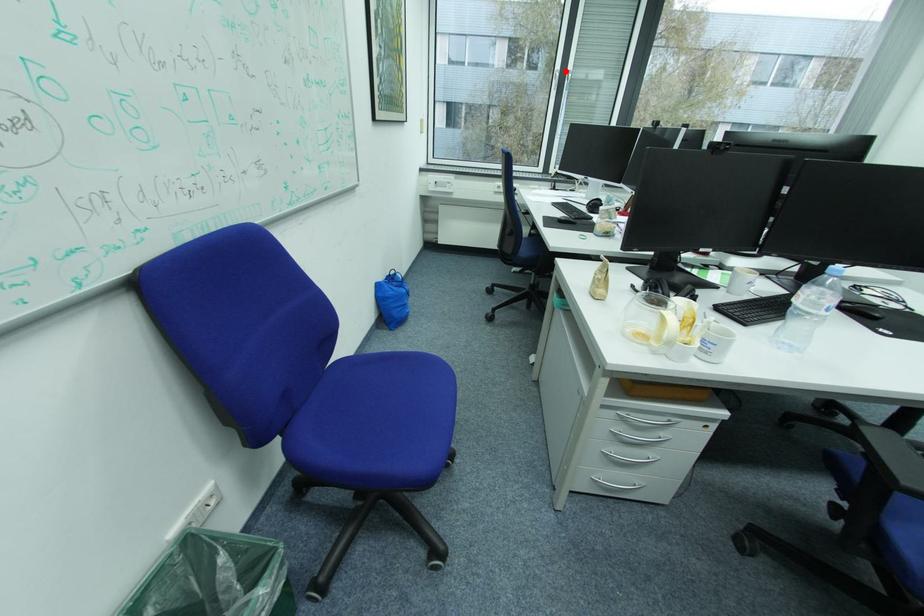
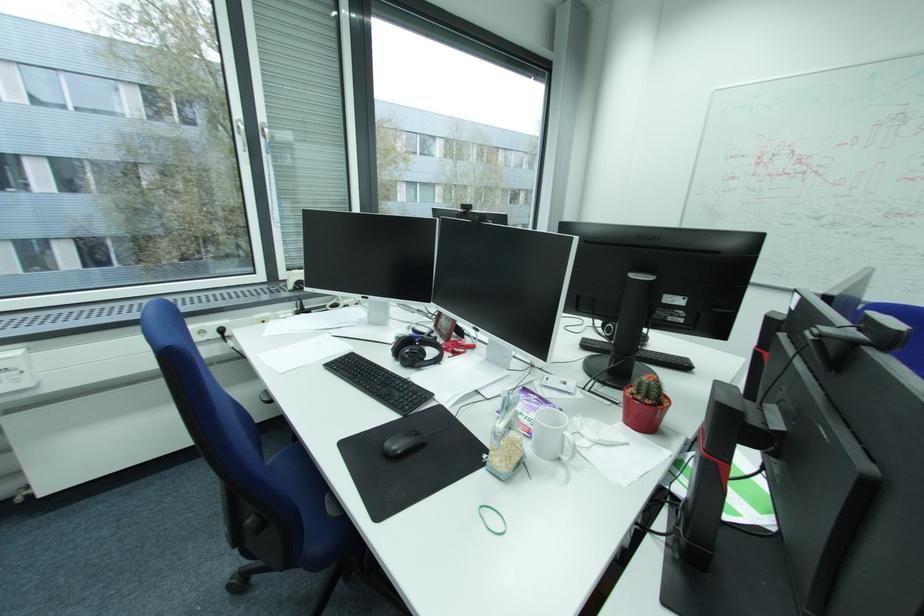
Question: I am providing you with two images of the same scene from different viewpoints. Image1 has a red point marked. In image2, the corresponding 3D location appears at what relative position? Reply with the corresponding letter.

Choices:
 (A) Closer
 (B) Farther

Answer: (B)